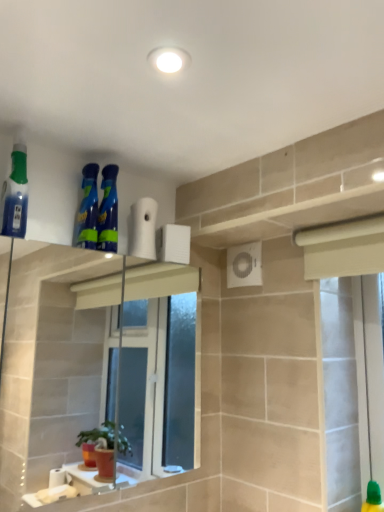
Question: Relative to blue glossy spray bottles at upper center, which appears as the 1th cleaning product when viewed from the right, is translucent blue spray bottle at left, the 1th cleaning product in the left-to-right sequence, in front or behind?

Choices:
 (A) behind
 (B) front

Answer: (B)

Question: Does point (13, 193) appear closer or farther from the camera than point (112, 242)?

Choices:
 (A) closer
 (B) farther

Answer: (A)

Question: Which object is positioned farthest from the white matte toilet paper at upper center?

Choices:
 (A) translucent blue spray bottle at left, which appears as the third cleaning product when viewed from the right
 (B) blue glossy spray bottles at upper center, the second cleaning product positioned from the left
 (C) blue glossy spray bottles at upper center, which appears as the 1th cleaning product when viewed from the right

Answer: (A)

Question: Which object is the farthest from the white matte toilet paper at upper center?

Choices:
 (A) translucent blue spray bottle at left, which appears as the third cleaning product when viewed from the right
 (B) blue glossy spray bottles at upper center, which appears as the 1th cleaning product when viewed from the right
 (C) blue glossy spray bottles at upper center, the second cleaning product positioned from the left

Answer: (A)